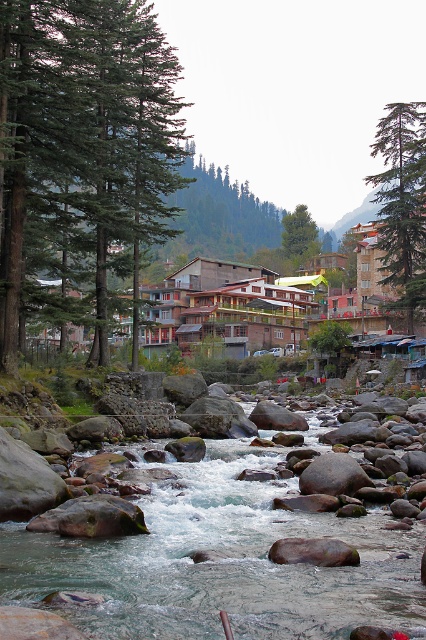
Question: Does green evergreen trees at left appear over green matte tree at upper right?

Choices:
 (A) yes
 (B) no

Answer: (B)

Question: Estimate the real-world distances between objects in this image. Which object is closer to the smooth rock river at center?

Choices:
 (A) green matte tree at center
 (B) green matte tree at upper right
 (C) green evergreen trees at left

Answer: (C)

Question: Which point appears farthest from the camera in this image?

Choices:
 (A) (43, 177)
 (B) (190, 584)

Answer: (A)

Question: Can you confirm if green evergreen trees at left is wider than smooth rock river at center?

Choices:
 (A) no
 (B) yes

Answer: (B)

Question: Is green evergreen trees at left above green matte tree at upper right?

Choices:
 (A) no
 (B) yes

Answer: (A)

Question: Estimate the real-world distances between objects in this image. Which object is closer to the green matte tree at center?

Choices:
 (A) green evergreen trees at left
 (B) green matte tree at upper right
 (C) smooth rock river at center

Answer: (B)